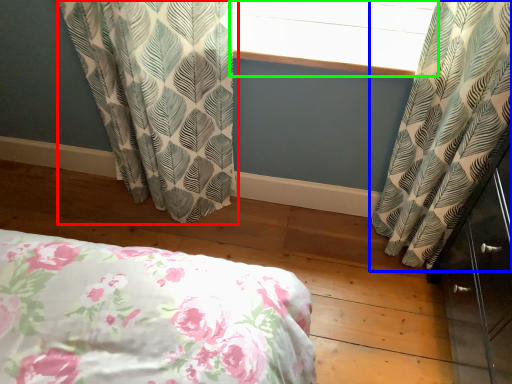
Question: Which is nearer to the curtain (highlighted by a red box)? curtain (highlighted by a blue box) or window screen (highlighted by a green box).

Choices:
 (A) curtain
 (B) window screen

Answer: (B)